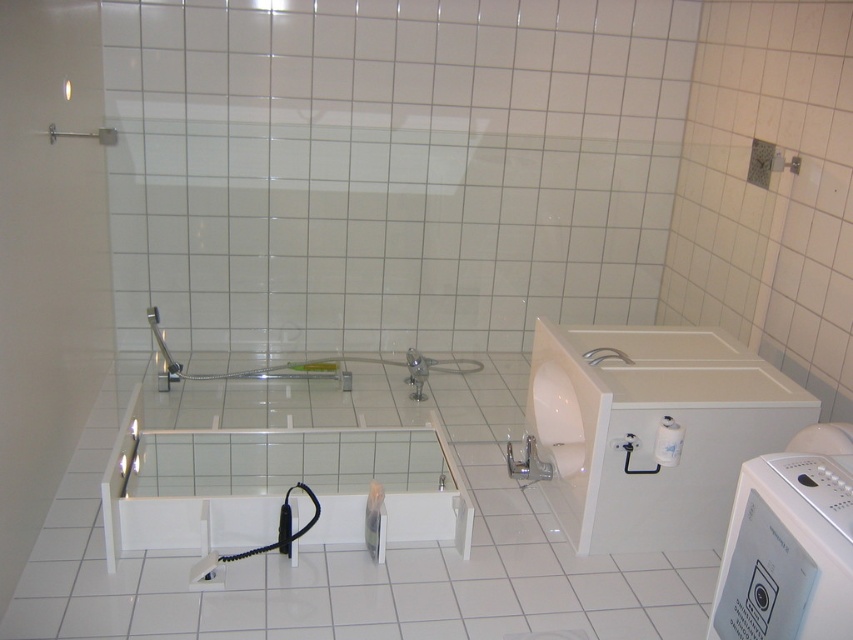
You are a delivery person trying to place a new white plastic washing machine at lower right in the bathroom. The current white glossy bathtub at center is in the way. Can you move the bathtub to make space for the washing machine?

The white glossy bathtub at center is above the white plastic washing machine at lower right, so moving the bathtub downward would allow space for the washing machine.

In the scene shown: You are moving a new white plastic washing machine at lower right into the bathroom. The existing white glossy bathtub at center is in the way. Can you move the washing machine around the bathtub without disassembling it?

The white glossy bathtub at center is larger in size than the white plastic washing machine at lower right. Since the bathtub is bigger, there might be enough space to maneuver the washing machine around it, but the exact feasibility depends on the available clearance in the bathroom layout not specified here.

Consider the image. You are moving into this bathroom and need to place a new white glossy washing machine at right and a white plastic washing machine at lower right. Given their sizes, which one requires more space for installation?

The white glossy washing machine at right requires more space for installation because it is larger in size than the white plastic washing machine at lower right.